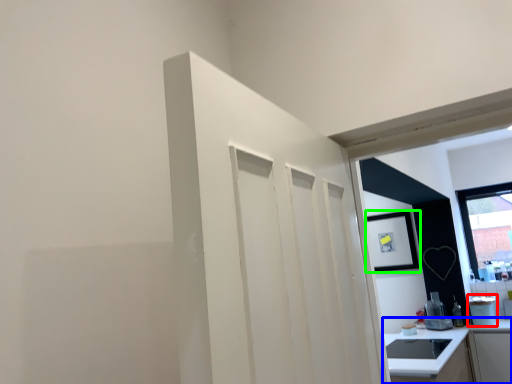
Question: Considering the real-world distances, which object is closest to appliance (highlighted by a red box)? countertop (highlighted by a blue box) or picture frame (highlighted by a green box).

Choices:
 (A) countertop
 (B) picture frame

Answer: (B)